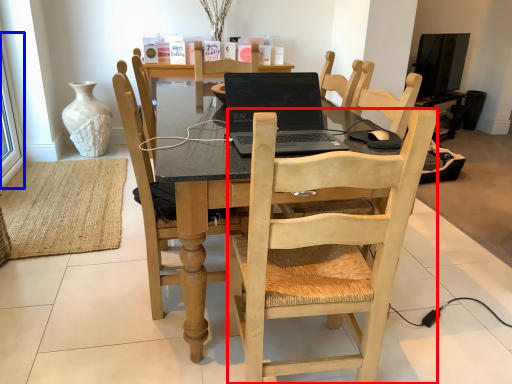
Question: Which object appears closest to the camera in this image, chair (highlighted by a red box) or window screen (highlighted by a blue box)?

Choices:
 (A) chair
 (B) window screen

Answer: (A)